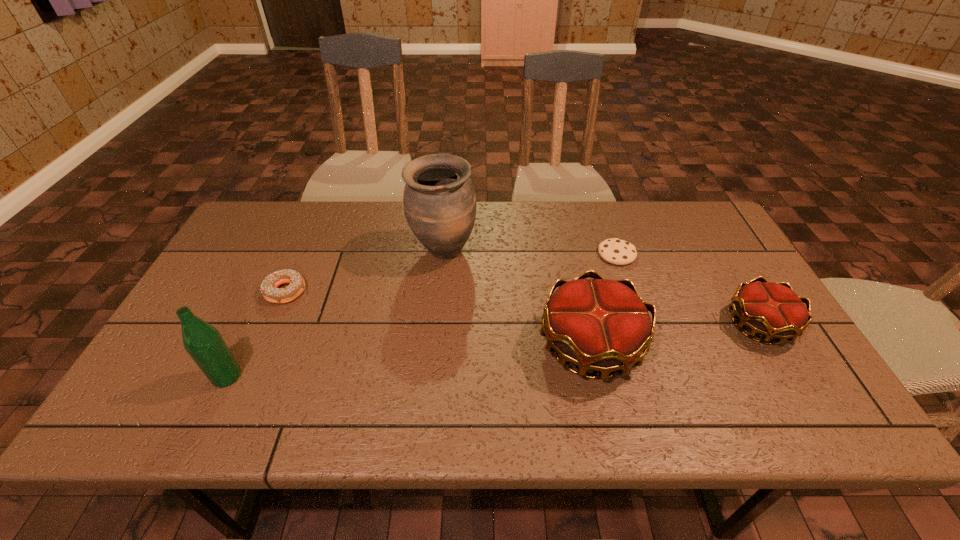
Observe the arrangement of all crowns in the image. To keep them evenly spaced, where would you place another crown on the left? Please locate a free space. Please provide its 2D coordinates. Your answer should be formatted as a tuple, i.e. [(x, y)], where the tuple contains the x and y coordinates of a point satisfying the conditions above.

[(406, 367)]